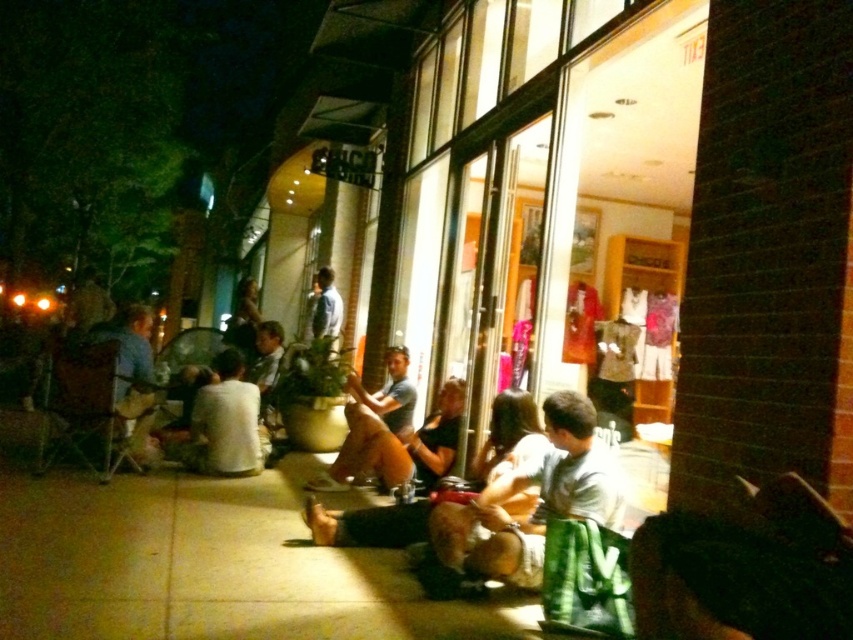
Is smooth concrete pavement at center smaller than green fabric skirt at center?

No, smooth concrete pavement at center is not smaller than green fabric skirt at center.

Who is more distant from viewer, (18, 476) or (436, 516)?

Point (18, 476)

You are a GUI agent. You are given a task and a screenshot of the screen. Output one action in this format:
    pyautogui.click(x=<x>, y=<y>)
    Task: Click on the smooth concrete pavement at center
    
    Given the screenshot: What is the action you would take?
    pyautogui.click(x=207, y=564)

Is smooth concrete pavement at center in front of light blue shirt at center?

Yes, smooth concrete pavement at center is in front of light blue shirt at center.

Which is in front, point (247, 627) or point (334, 289)?

Point (247, 627)

Locate an element on the screen. The width and height of the screenshot is (853, 640). smooth concrete pavement at center is located at coordinates (207, 564).

Is green fabric skirt at center to the left of light blue shirt at center from the viewer's perspective?

No, green fabric skirt at center is not to the left of light blue shirt at center.

Does green fabric skirt at center have a lesser width compared to light blue shirt at center?

Incorrect, green fabric skirt at center's width is not less than light blue shirt at center's.

Does point (508, 472) come behind point (310, 320)?

No, (508, 472) is closer to viewer.

At what (x,y) coordinates should I click in order to perform the action: click on green fabric skirt at center. Please return your answer as a coordinate pair (x, y). Looking at the image, I should click on (538, 499).